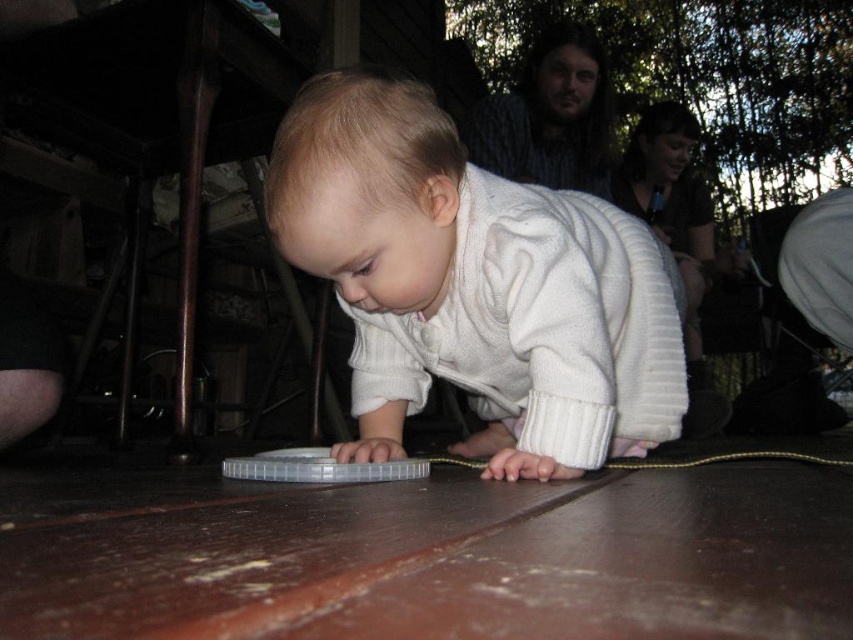
Does white ribbed sweater at center lie in front of clear plastic lid at center?

No, it is behind clear plastic lid at center.

At what (x,y) coordinates should I click in order to perform the action: click on white ribbed sweater at center. Please return your answer as a coordinate pair (x, y). Looking at the image, I should click on (474, 285).